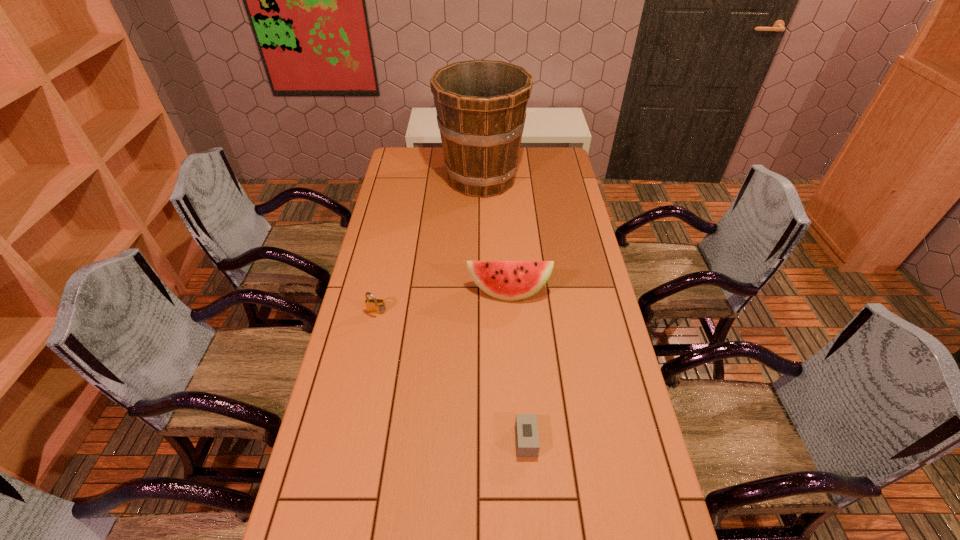
What are the coordinates of `vacant region at the far right corner of the desktop` in the screenshot? It's located at (553, 166).

Find the location of a particular element. unoccupied area between the third nearest object and the padlock is located at coordinates (443, 302).

At what (x,y) coordinates should I click in order to perform the action: click on free space between the farthest object and the third tallest object. Please return your answer as a coordinate pair (x, y). Image resolution: width=960 pixels, height=540 pixels. Looking at the image, I should click on (429, 246).

This screenshot has width=960, height=540. Identify the location of vacant area that lies between the third farthest object and the watermelon. (443, 302).

This screenshot has height=540, width=960. Identify the location of vacant area that lies between the third nearest object and the leftmost object. (443, 302).

This screenshot has width=960, height=540. Identify the location of vacant area that lies between the nearest object and the third shortest object. (517, 366).

The image size is (960, 540). In order to click on vacant region between the watermelon and the padlock in this screenshot , I will do `click(443, 302)`.

This screenshot has height=540, width=960. In order to click on free spot between the third shortest object and the padlock in this screenshot , I will do `click(443, 302)`.

Find the location of a particular element. The height and width of the screenshot is (540, 960). vacant area between the second shortest object and the bucket is located at coordinates (429, 246).

At what (x,y) coordinates should I click in order to perform the action: click on empty space between the padlock and the tallest object. Please return your answer as a coordinate pair (x, y). The height and width of the screenshot is (540, 960). Looking at the image, I should click on (429, 246).